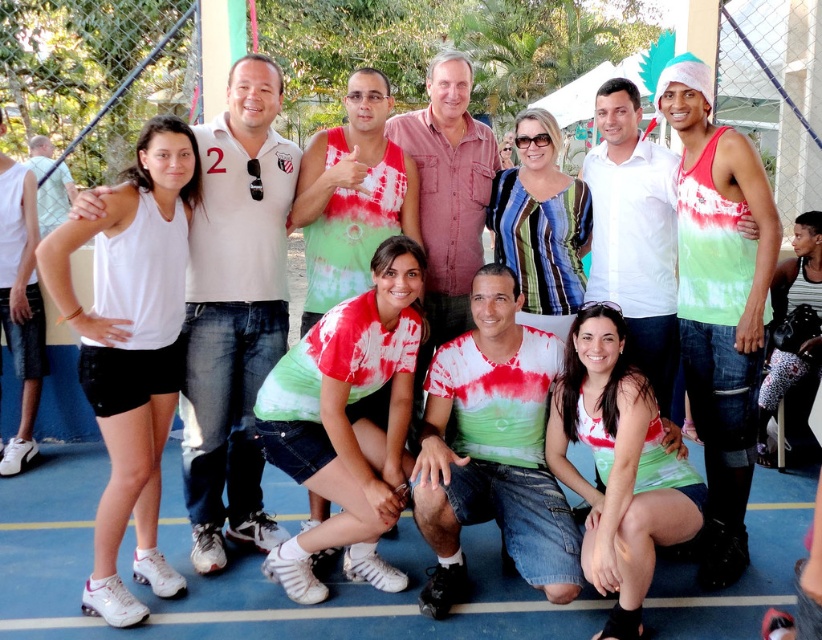
Question: Is white matte tank top at left smaller than tie-dye fabric shirt at center?

Choices:
 (A) yes
 (B) no

Answer: (A)

Question: Which object is positioned farthest from the red tie-dye tank top at center?

Choices:
 (A) matte tie-dye shirt at lower center
 (B) white cotton polo shirt at left

Answer: (B)

Question: Among these objects, which one is nearest to the camera?

Choices:
 (A) tie-dye fabric shirt at center
 (B) matte tie-dye shirt at lower center
 (C) red tie-dye tank top at center

Answer: (B)

Question: Which point is farther from the camera taking this photo?

Choices:
 (A) (183, 417)
 (B) (769, 273)
 (C) (47, 145)
 (D) (99, 346)

Answer: (C)

Question: From the image, what is the correct spatial relationship of white matte tank top at left in relation to green tie-dye tank top at right?

Choices:
 (A) above
 (B) below

Answer: (B)

Question: Is red tie-dye tank top at center further to the viewer compared to matte tie-dye shirt at lower center?

Choices:
 (A) yes
 (B) no

Answer: (A)